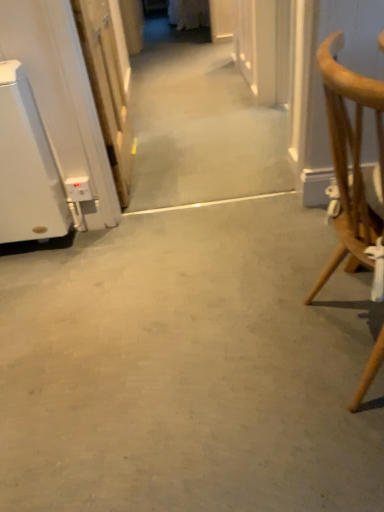
Question: Considering the relative sizes of white glossy door at left and gray concrete floor at center in the image provided, is white glossy door at left bigger than gray concrete floor at center?

Choices:
 (A) no
 (B) yes

Answer: (A)

Question: Can you confirm if white glossy door at left is positioned to the right of gray concrete floor at center?

Choices:
 (A) no
 (B) yes

Answer: (A)

Question: Can you confirm if white glossy door at left is thinner than gray concrete floor at center?

Choices:
 (A) no
 (B) yes

Answer: (B)

Question: Does white glossy door at left have a greater width compared to gray concrete floor at center?

Choices:
 (A) yes
 (B) no

Answer: (B)

Question: From a real-world perspective, is white glossy door at left below gray concrete floor at center?

Choices:
 (A) yes
 (B) no

Answer: (B)

Question: In terms of height, does gray concrete floor at center look taller or shorter compared to white glossy door at left?

Choices:
 (A) tall
 (B) short

Answer: (B)

Question: From a real-world perspective, is gray concrete floor at center physically located above or below white glossy door at left?

Choices:
 (A) below
 (B) above

Answer: (A)

Question: Based on their sizes in the image, would you say gray concrete floor at center is bigger or smaller than white glossy door at left?

Choices:
 (A) big
 (B) small

Answer: (A)

Question: In terms of width, does gray concrete floor at center look wider or thinner when compared to white glossy door at left?

Choices:
 (A) wide
 (B) thin

Answer: (A)

Question: Is light brown wooden chair at right taller or shorter than gray concrete floor at center?

Choices:
 (A) short
 (B) tall

Answer: (B)

Question: From the image's perspective, relative to gray concrete floor at center, is light brown wooden chair at right above or below?

Choices:
 (A) above
 (B) below

Answer: (A)

Question: In terms of size, does light brown wooden chair at right appear bigger or smaller than gray concrete floor at center?

Choices:
 (A) big
 (B) small

Answer: (A)

Question: From a real-world perspective, is light brown wooden chair at right positioned above or below gray concrete floor at center?

Choices:
 (A) below
 (B) above

Answer: (B)

Question: In terms of size, does light brown wooden chair at right appear bigger or smaller than white glossy door at left?

Choices:
 (A) big
 (B) small

Answer: (A)

Question: Would you say light brown wooden chair at right is inside or outside white glossy door at left?

Choices:
 (A) inside
 (B) outside

Answer: (B)